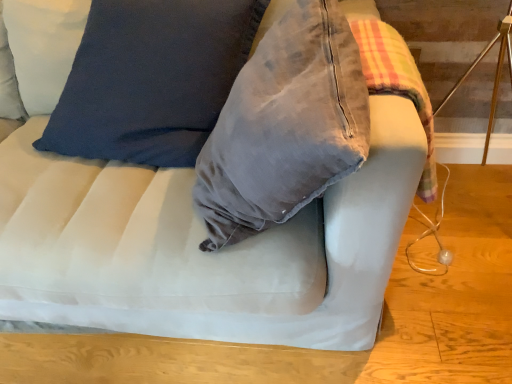
Question: Should I look upward or downward to see white fabric mattress at center?

Choices:
 (A) up
 (B) down

Answer: (B)